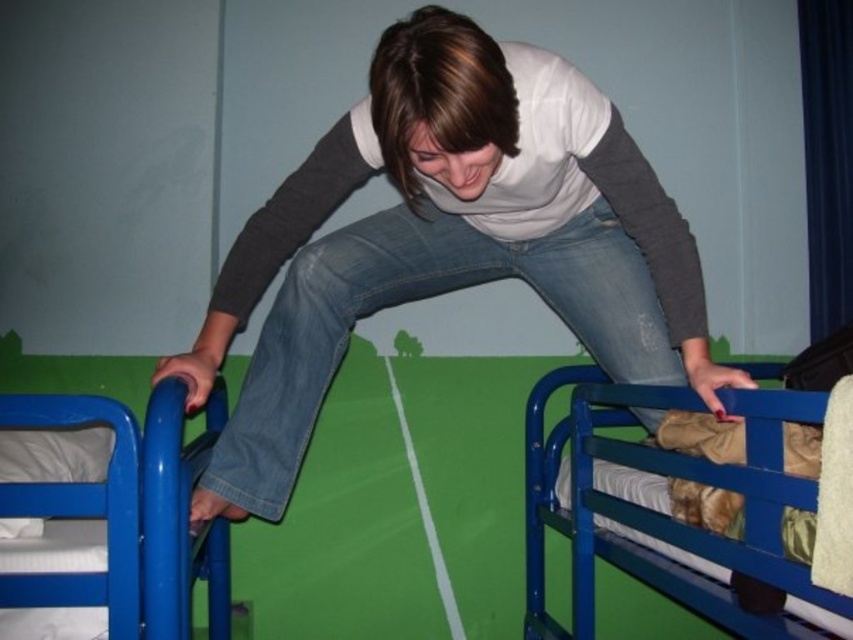
Who is more forward, (270, 275) or (62, 492)?

Positioned in front is point (62, 492).

Which is more to the left, jeans at center or blue metallic bunk bed at left?

blue metallic bunk bed at left is more to the left.

Between point (677, 230) and point (42, 608), which one is positioned in front?

Point (42, 608) is more forward.

I want to click on jeans at center, so click(x=448, y=241).

Is point (770, 467) farther from viewer compared to point (144, 547)?

Yes, it is.

Can you confirm if blue metal bunk bed at upper right is thinner than blue metallic bunk bed at left?

Indeed, blue metal bunk bed at upper right has a lesser width compared to blue metallic bunk bed at left.

Who is more forward, (666, 397) or (4, 476)?

Point (666, 397) is more forward.

Identify the location of blue metal bunk bed at upper right. This screenshot has width=853, height=640. coord(666,509).

Find the location of a particular element. jeans at center is located at coordinates (448, 241).

Is jeans at center below blue metal bunk bed at upper right?

No.

Does point (393, 45) come behind point (700, 600)?

No, (393, 45) is closer to viewer.

Identify the location of jeans at center. This screenshot has height=640, width=853. (448, 241).